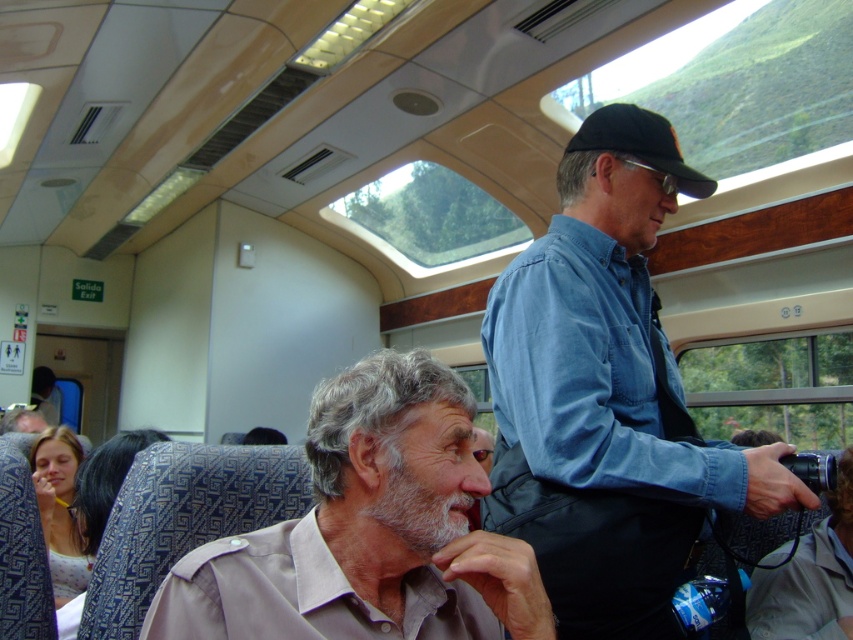
Question: Does blue denim shirt at upper center come in front of gray fabric shirt at lower left?

Choices:
 (A) yes
 (B) no

Answer: (B)

Question: Which object is positioned farthest from the blue denim shirt at upper center?

Choices:
 (A) black fabric baseball cap at upper right
 (B) gray fabric shirt at lower left

Answer: (B)

Question: Can you confirm if blue denim shirt at upper center is positioned to the right of gray fabric shirt at lower left?

Choices:
 (A) yes
 (B) no

Answer: (A)

Question: Does blue denim shirt at upper center lie behind gray fabric shirt at lower left?

Choices:
 (A) no
 (B) yes

Answer: (B)

Question: Among these objects, which one is farthest from the camera?

Choices:
 (A) black fabric baseball cap at upper right
 (B) blue denim shirt at upper center
 (C) gray fabric shirt at lower left

Answer: (A)

Question: Which point is farther to the camera?

Choices:
 (A) (471, 477)
 (B) (631, 134)

Answer: (B)